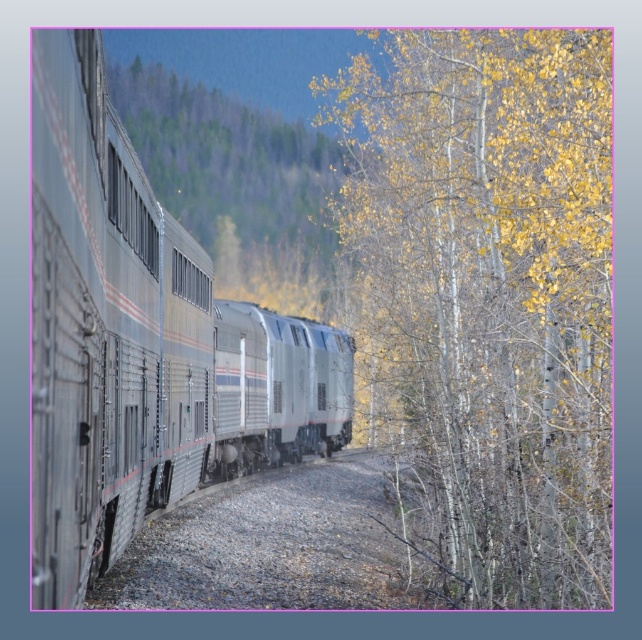
In the scene shown: Which is more to the left, yellow leafy tree at right or silver metallic train at left?

silver metallic train at left

Who is shorter, yellow leafy tree at right or silver metallic train at left?

With less height is silver metallic train at left.

Find the location of a particular element. Image resolution: width=642 pixels, height=640 pixels. yellow leafy tree at right is located at coordinates (492, 289).

Does silver metallic train at left lie in front of green matte train at left?

Yes, it is in front of green matte train at left.

Does silver metallic train at left appear over green matte train at left?

Actually, silver metallic train at left is below green matte train at left.

Between point (94, 35) and point (293, 200), which one is positioned in front?

Point (94, 35) is more forward.

The width and height of the screenshot is (642, 640). Find the location of `silver metallic train at left`. silver metallic train at left is located at coordinates (143, 342).

Does yellow leafy tree at right have a larger size compared to green matte train at left?

Yes, yellow leafy tree at right is bigger than green matte train at left.

Between yellow leafy tree at right and green matte train at left, which one is positioned lower?

Positioned lower is yellow leafy tree at right.

Between point (422, 186) and point (322, 268), which one is positioned in front?

Positioned in front is point (422, 186).

I want to click on yellow leafy tree at right, so click(492, 289).